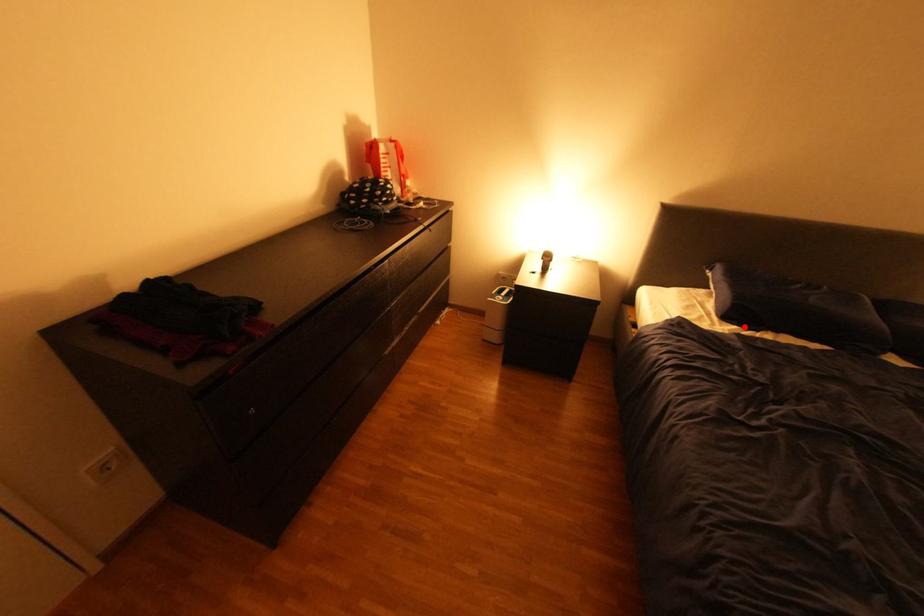
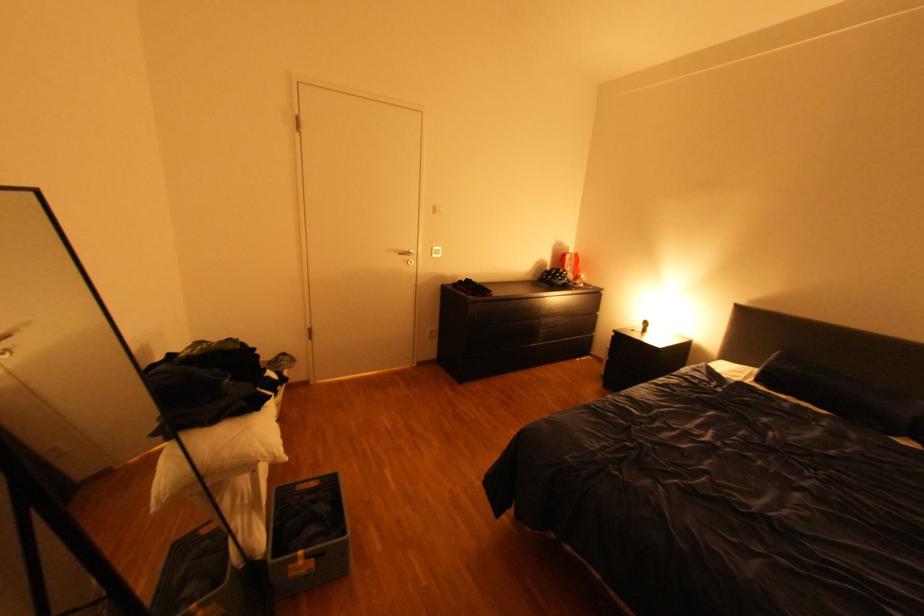
Find the pixel in the second image that matches the highlighted location in the first image.

(771, 387)